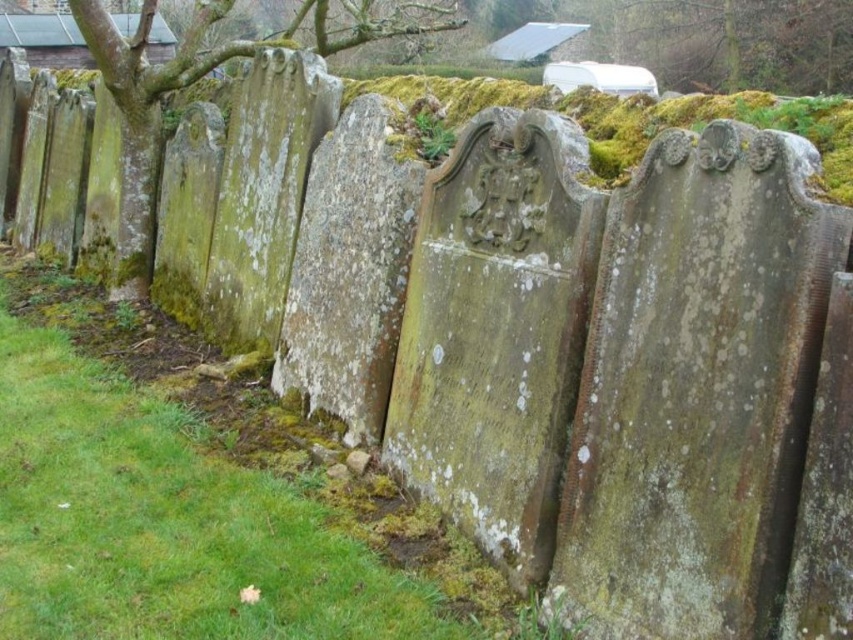
You are standing at the camera position and want to place a 3 feet wide flower pot between the green mossy grass at lower left and the camera. Is there enough space?

The distance between the green mossy grass at lower left and the camera is 7.74 feet, so placing a 3 feet wide flower pot between them is possible since 3 feet is less than 7.74 feet.

You are standing at the entrance of the cemetery and want to reach the point marked as point (238,634). If your walking speed is 1.2 meters per second, how long will it take you to reach that point?

The distance between you and point (238,634) is 2.44 meters. At a speed of 1.2 meters per second, it will take approximately 2.03 seconds to reach the point.

You are standing at the entrance of the cemetery and want to place a small decorative rock. You have two options for placement near the green mossy grass at lower left and the green mossy tree at upper left. Which location has more space for the rock?

The green mossy grass at lower left has more space because it is bigger than the green mossy tree at upper left.